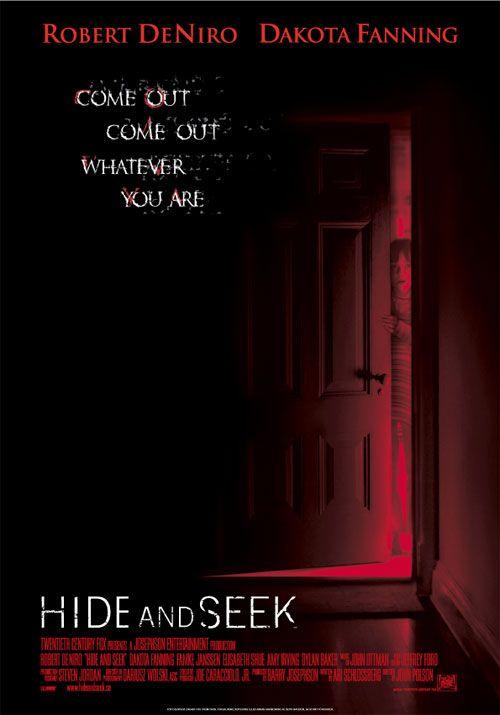
At what (x,y) coordinates should I click in order to perform the action: click on doorknob. Please return your answer as a coordinate pair (x, y). This screenshot has width=500, height=715. Looking at the image, I should click on (383, 380).